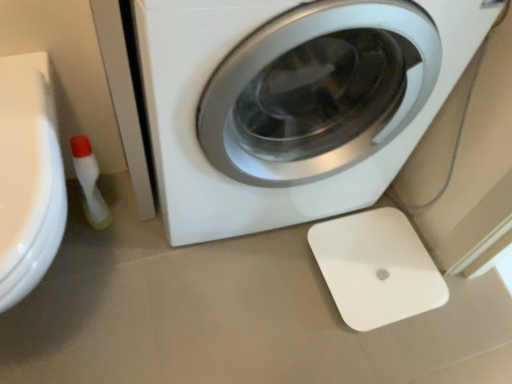
Question: Is white plastic scale at lower right located within translucent plastic bottle at lower left?

Choices:
 (A) yes
 (B) no

Answer: (B)

Question: Is translucent plastic bottle at lower left closer to the viewer compared to white plastic scale at lower right?

Choices:
 (A) no
 (B) yes

Answer: (B)

Question: Does translucent plastic bottle at lower left have a greater height compared to white plastic scale at lower right?

Choices:
 (A) yes
 (B) no

Answer: (A)

Question: From the image's perspective, does translucent plastic bottle at lower left appear lower than white plastic scale at lower right?

Choices:
 (A) no
 (B) yes

Answer: (A)

Question: Is translucent plastic bottle at lower left not close to white plastic scale at lower right?

Choices:
 (A) yes
 (B) no

Answer: (B)

Question: From a real-world perspective, is white glossy washing machine at center physically located above or below white plastic scale at lower right?

Choices:
 (A) above
 (B) below

Answer: (A)

Question: Is white glossy washing machine at center to the left or to the right of white plastic scale at lower right in the image?

Choices:
 (A) left
 (B) right

Answer: (A)

Question: Is white glossy washing machine at center wider or thinner than white plastic scale at lower right?

Choices:
 (A) wide
 (B) thin

Answer: (A)

Question: From their relative heights in the image, would you say white glossy washing machine at center is taller or shorter than white plastic scale at lower right?

Choices:
 (A) tall
 (B) short

Answer: (A)

Question: From the image's perspective, is translucent plastic bottle at lower left positioned above or below white plastic scale at lower right?

Choices:
 (A) above
 (B) below

Answer: (A)

Question: In terms of width, does translucent plastic bottle at lower left look wider or thinner when compared to white plastic scale at lower right?

Choices:
 (A) wide
 (B) thin

Answer: (B)

Question: Is translucent plastic bottle at lower left in front of or behind white plastic scale at lower right in the image?

Choices:
 (A) front
 (B) behind

Answer: (A)

Question: Is point (80, 185) positioned closer to the camera than point (316, 241)?

Choices:
 (A) closer
 (B) farther

Answer: (A)

Question: Is point (276, 137) closer or farther from the camera than point (75, 172)?

Choices:
 (A) farther
 (B) closer

Answer: (B)

Question: From a real-world perspective, relative to translucent plastic bottle at lower left, is white glossy washing machine at center vertically above or below?

Choices:
 (A) above
 (B) below

Answer: (A)